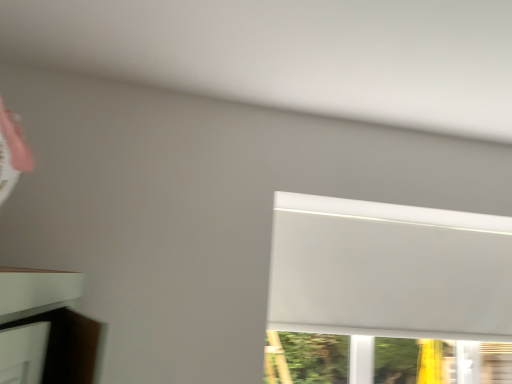
Question: Should I look upward or downward to see white matte window at upper right?

Choices:
 (A) up
 (B) down

Answer: (B)